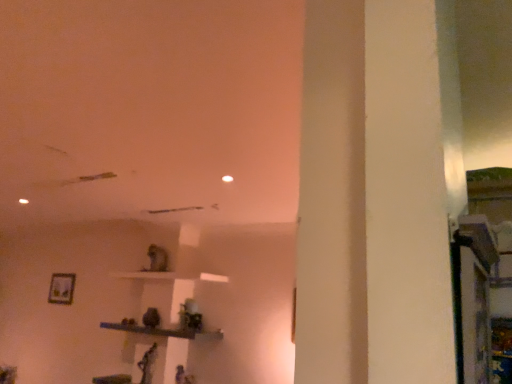
Question: Is matte silver picture frame at lower left positioned in front of wooden shelf at center?

Choices:
 (A) no
 (B) yes

Answer: (A)

Question: Is the position of matte silver picture frame at lower left more distant than that of wooden shelf at center?

Choices:
 (A) yes
 (B) no

Answer: (A)

Question: Is matte silver picture frame at lower left thinner than wooden shelf at center?

Choices:
 (A) yes
 (B) no

Answer: (A)

Question: Is matte silver picture frame at lower left shorter than wooden shelf at center?

Choices:
 (A) yes
 (B) no

Answer: (B)

Question: Is matte silver picture frame at lower left facing towards wooden shelf at center?

Choices:
 (A) yes
 (B) no

Answer: (B)

Question: From the image's perspective, does matte silver picture frame at lower left appear higher than wooden shelf at center?

Choices:
 (A) yes
 (B) no

Answer: (A)

Question: Is wooden shelf at center bigger than matte silver picture frame at lower left?

Choices:
 (A) no
 (B) yes

Answer: (B)

Question: Would you consider wooden shelf at center to be distant from matte silver picture frame at lower left?

Choices:
 (A) yes
 (B) no

Answer: (A)

Question: From the image's perspective, does wooden shelf at center appear lower than matte silver picture frame at lower left?

Choices:
 (A) yes
 (B) no

Answer: (A)

Question: Is matte silver picture frame at lower left inside wooden shelf at center?

Choices:
 (A) no
 (B) yes

Answer: (A)

Question: Does wooden shelf at center have a smaller size compared to matte silver picture frame at lower left?

Choices:
 (A) yes
 (B) no

Answer: (B)

Question: Is wooden shelf at center to the left of matte silver picture frame at lower left from the viewer's perspective?

Choices:
 (A) no
 (B) yes

Answer: (A)

Question: Considering the positions of wooden shelf at center and matte silver picture frame at lower left in the image, is wooden shelf at center wider or thinner than matte silver picture frame at lower left?

Choices:
 (A) wide
 (B) thin

Answer: (A)